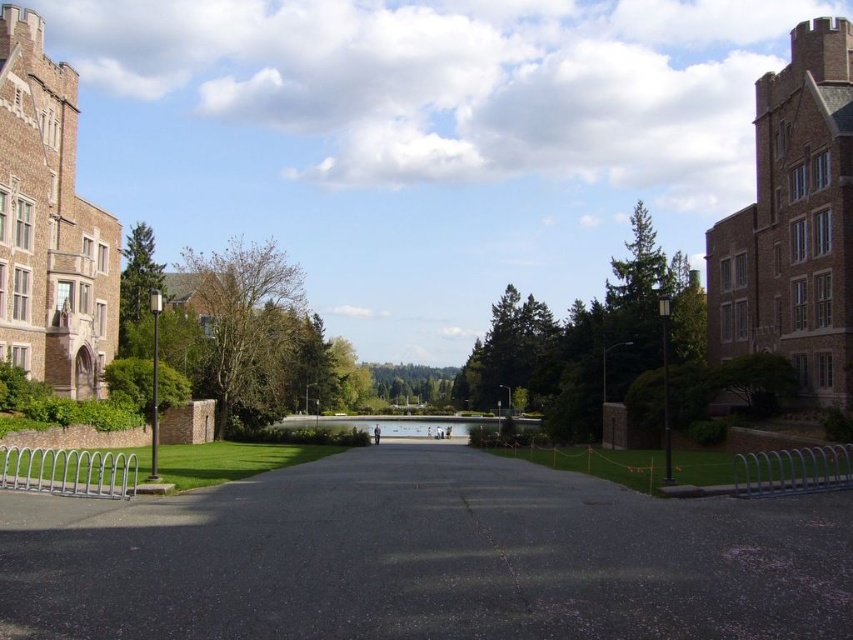
Is black asphalt path at center below clear glass lake at center?

No.

Can you confirm if black asphalt path at center is positioned to the right of clear glass lake at center?

Yes, black asphalt path at center is to the right of clear glass lake at center.

The height and width of the screenshot is (640, 853). I want to click on black asphalt path at center, so click(425, 557).